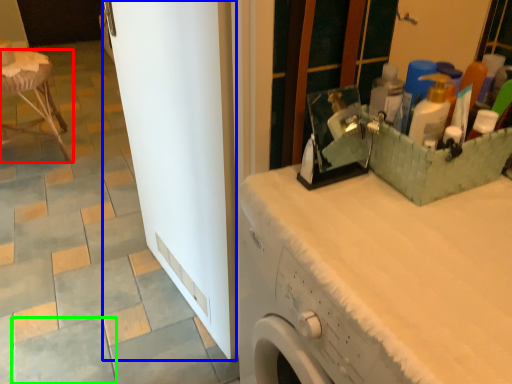
Question: Considering the real-world distances, which object is farthest from furniture (highlighted by a red box)? screen door (highlighted by a blue box) or ceramic tile (highlighted by a green box)?

Choices:
 (A) screen door
 (B) ceramic tile

Answer: (B)